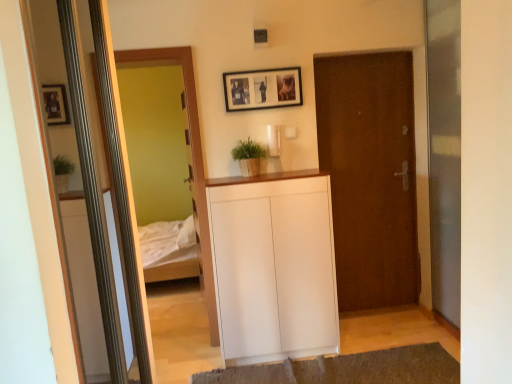
Question: Are wooden framed mirror at left and brown matte door at center far apart?

Choices:
 (A) no
 (B) yes

Answer: (B)

Question: Does wooden framed mirror at left have a lesser width compared to brown matte door at center?

Choices:
 (A) yes
 (B) no

Answer: (B)

Question: Is wooden framed mirror at left next to brown matte door at center?

Choices:
 (A) no
 (B) yes

Answer: (A)

Question: Is wooden framed mirror at left taller than brown matte door at center?

Choices:
 (A) yes
 (B) no

Answer: (A)

Question: Considering the relative sizes of wooden framed mirror at left and brown matte door at center in the image provided, is wooden framed mirror at left wider than brown matte door at center?

Choices:
 (A) no
 (B) yes

Answer: (B)

Question: Does wooden framed mirror at left have a lesser height compared to brown matte door at center?

Choices:
 (A) yes
 (B) no

Answer: (B)

Question: Is brown textured rug at lower center thinner than wooden framed mirror at left?

Choices:
 (A) no
 (B) yes

Answer: (A)

Question: From the image's perspective, does brown textured rug at lower center appear higher than wooden framed mirror at left?

Choices:
 (A) yes
 (B) no

Answer: (B)

Question: Is brown textured rug at lower center wider than wooden framed mirror at left?

Choices:
 (A) no
 (B) yes

Answer: (B)

Question: Does brown textured rug at lower center appear on the left side of wooden framed mirror at left?

Choices:
 (A) no
 (B) yes

Answer: (A)

Question: Does brown textured rug at lower center come in front of wooden framed mirror at left?

Choices:
 (A) yes
 (B) no

Answer: (A)

Question: Can you confirm if brown textured rug at lower center is taller than wooden framed mirror at left?

Choices:
 (A) yes
 (B) no

Answer: (B)

Question: Is the position of wooden framed mirror at left more distant than that of white matte cabinet at center?

Choices:
 (A) yes
 (B) no

Answer: (A)